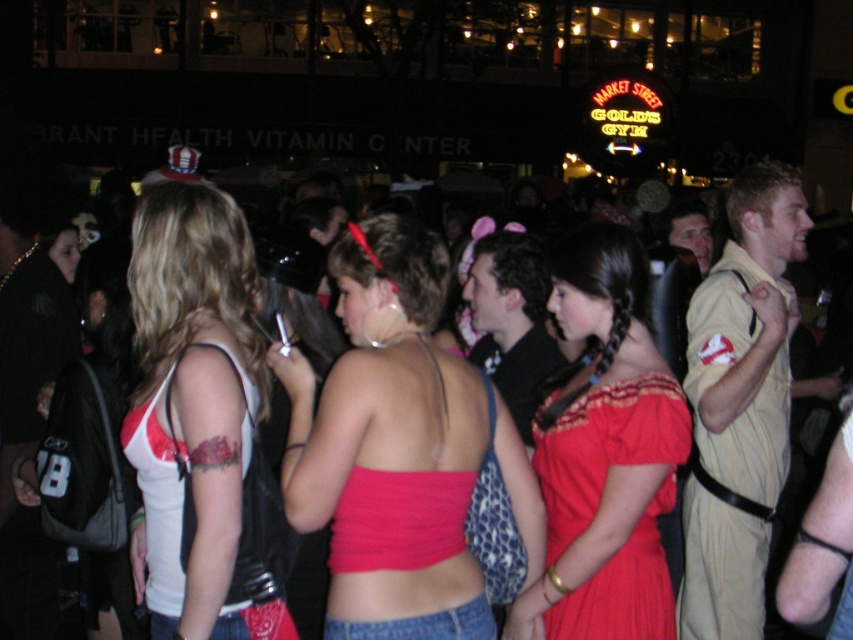
Question: Which object is closer to the camera taking this photo?

Choices:
 (A) tan leather jacket at right
 (B) matte pink fabric top at center
 (C) white matte tank top at center

Answer: (C)

Question: Which of the following is the closest to the observer?

Choices:
 (A) (648, 534)
 (B) (532, 305)

Answer: (A)

Question: Can you confirm if matte pink fabric top at center is thinner than black matte shirt at center?

Choices:
 (A) no
 (B) yes

Answer: (A)

Question: Is matte pink fabric top at center to the left of tan leather jacket at right from the viewer's perspective?

Choices:
 (A) yes
 (B) no

Answer: (A)

Question: Which point is closer to the camera?

Choices:
 (A) white matte tank top at center
 (B) matte red dress at center
 (C) tan leather jacket at right
 (D) matte pink fabric top at center

Answer: (A)

Question: Is matte red dress at center wider than tan leather jacket at right?

Choices:
 (A) yes
 (B) no

Answer: (B)